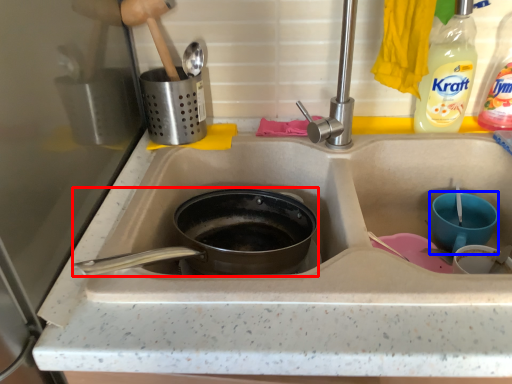
Question: Which of the following is the closest to the observer, frying pan (highlighted by a red box) or basin (highlighted by a blue box)?

Choices:
 (A) frying pan
 (B) basin

Answer: (A)